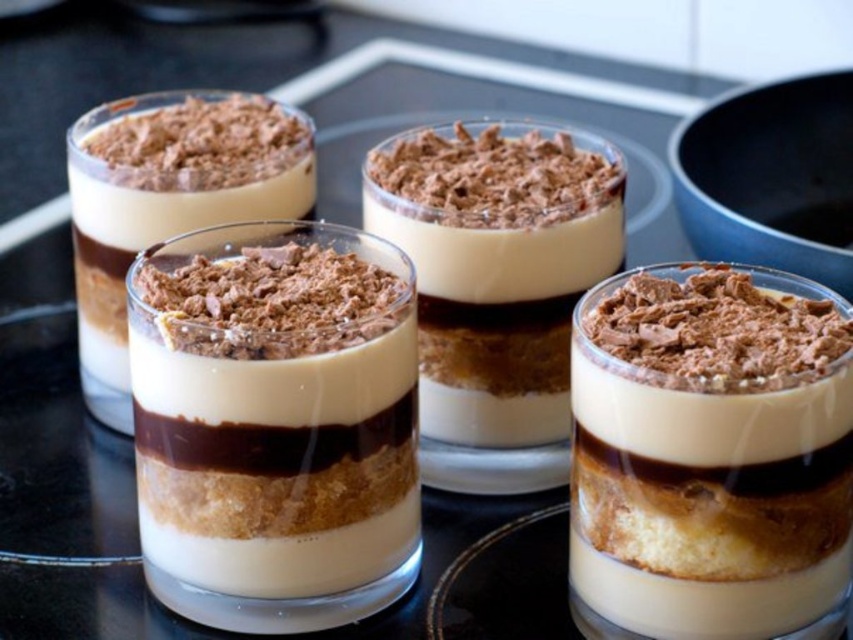
You are a dessert chef who wants to create a layered dessert with two types of chocolate. You have two options in the image, the matte chocolate dessert at center and the smooth chocolate mousse at center. Which one would you choose if you want the layer to be taller?

The smooth chocolate mousse at center is taller than the matte chocolate dessert at center, so you should choose the smooth chocolate mousse at center for a taller layer.

You are a chef preparing a dessert display and need to place a new dessert between the matte chocolate dessert at center and the smooth chocolate mousse at center. The new dessert requires 10 inches of space. Is there enough space between them?

The distance between the matte chocolate dessert at center and the smooth chocolate mousse at center is 8.47 inches. Since the new dessert requires 10 inches of space, there is not enough space between them.